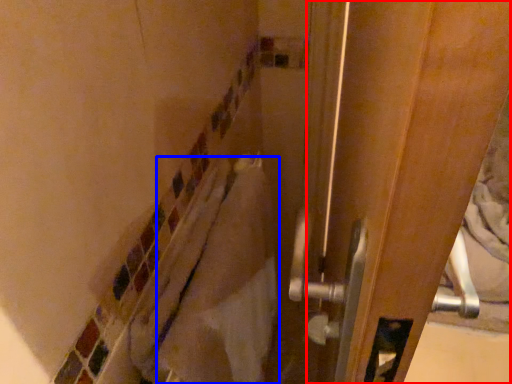
Question: Which object appears farthest to the camera in this image, screen door (highlighted by a red box) or material (highlighted by a blue box)?

Choices:
 (A) screen door
 (B) material

Answer: (B)